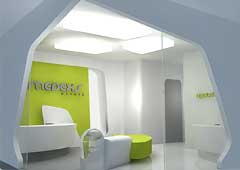
Image resolution: width=240 pixels, height=170 pixels. What are the coordinates of `bright ceiling light panels` in the screenshot? It's located at (105, 29), (139, 42), (91, 44).